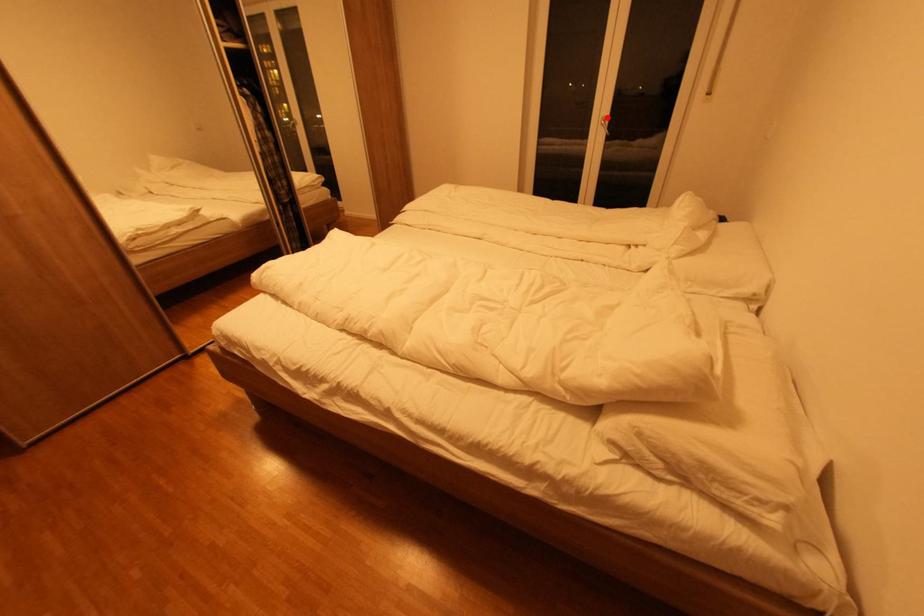
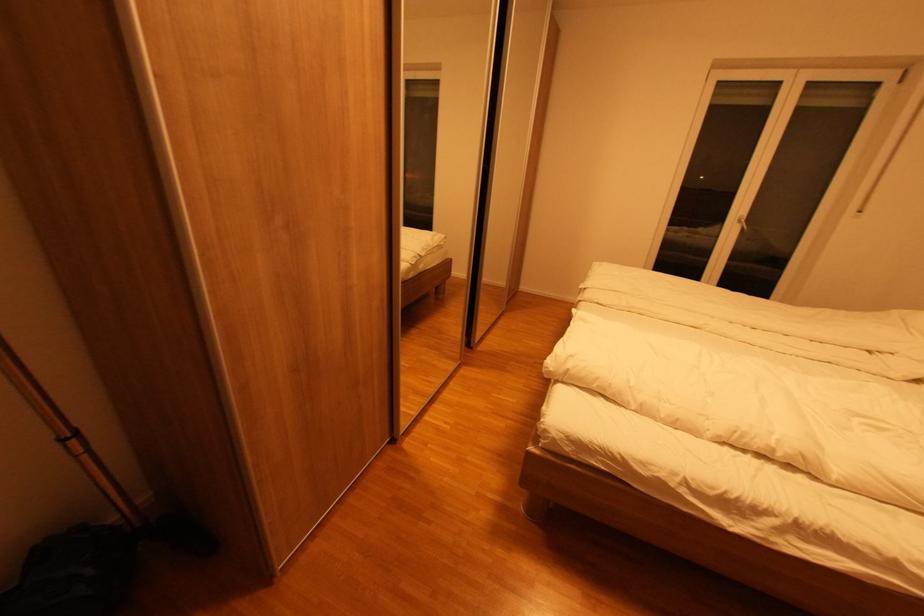
Question: I am providing you with two images of the same scene from different viewpoints. Image1 has a red point marked. In image2, the corresponding 3D location appears at what relative position? Reply with the corresponding letter.

Choices:
 (A) Closer
 (B) Farther

Answer: (B)